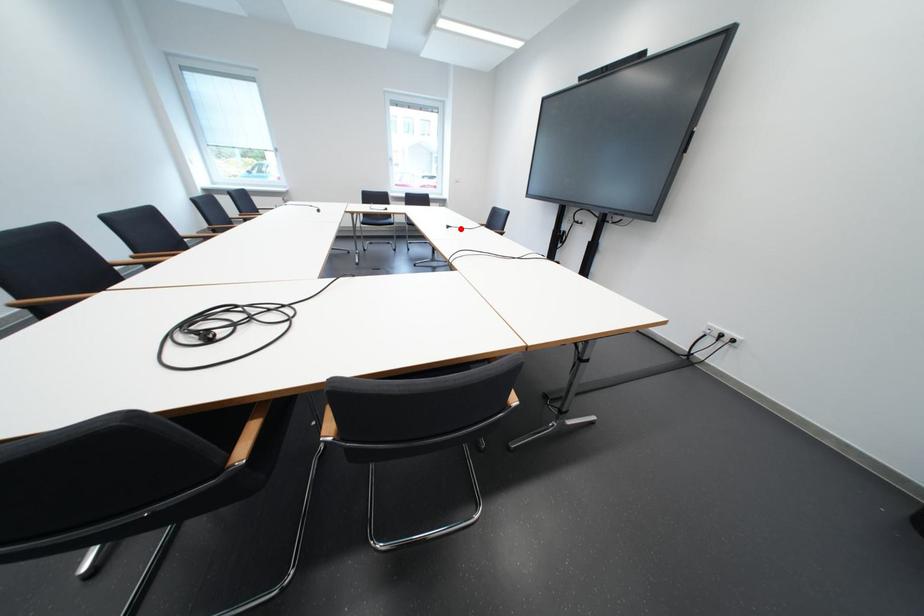
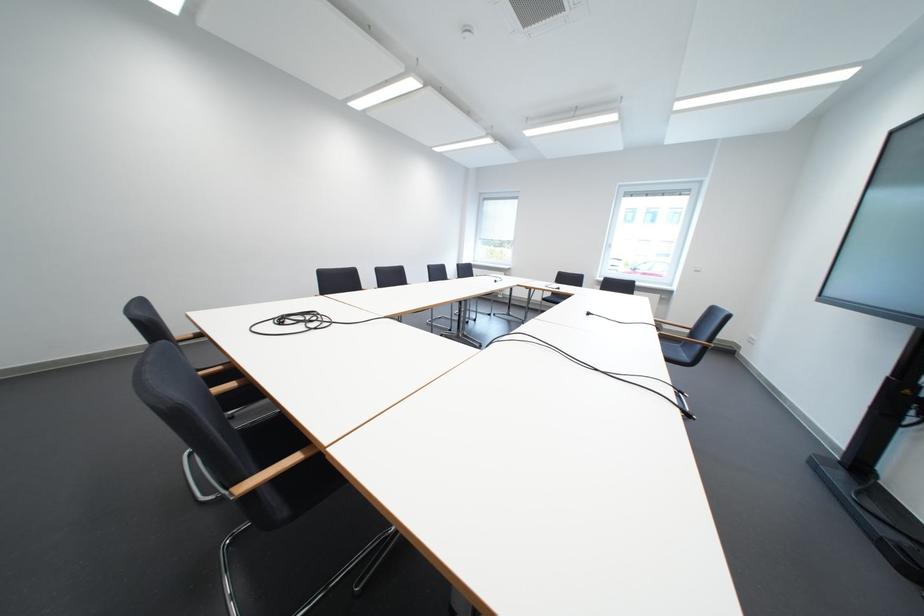
Find the pixel in the second image that matches the highlighted location in the first image.

(601, 315)